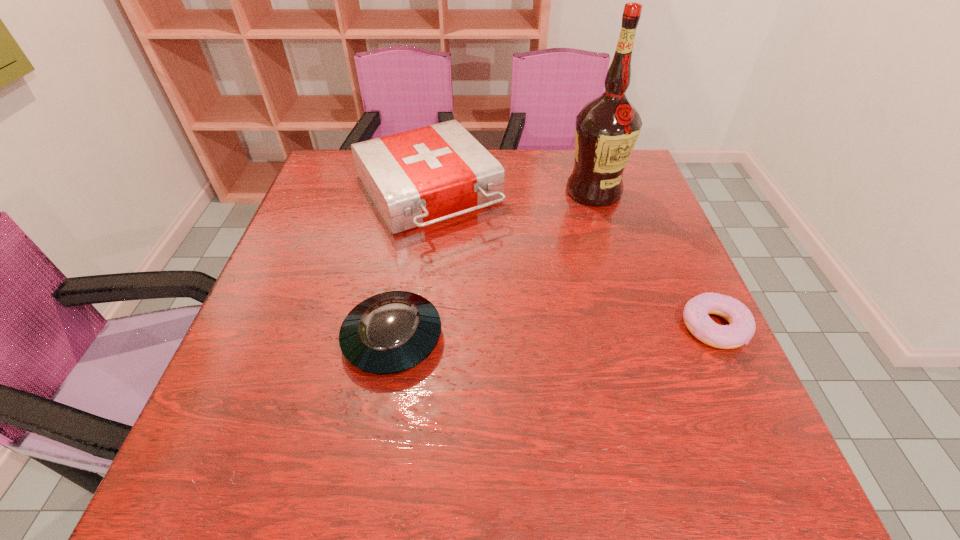
Where is `free space located 0.280m on the label of the tallest object`? The width and height of the screenshot is (960, 540). free space located 0.280m on the label of the tallest object is located at coordinates (583, 284).

Find the location of a particular element. The width and height of the screenshot is (960, 540). free space located 0.230m on the front side of the first-aid kit is located at coordinates (508, 309).

I want to click on free space located on the front side of the first-aid kit, so click(536, 348).

The image size is (960, 540). In order to click on vacant area located 0.140m on the front side of the first-aid kit in this screenshot , I will do `click(488, 281)`.

This screenshot has width=960, height=540. In order to click on alcohol present at the far edge in this screenshot , I will do `click(606, 130)`.

This screenshot has height=540, width=960. Find the location of `the first-aid kit present at the far edge`. the first-aid kit present at the far edge is located at coordinates (416, 178).

The width and height of the screenshot is (960, 540). Identify the location of object at the near edge. (388, 333).

What are the coordinates of `object located at the left edge` in the screenshot? It's located at (416, 178).

Find the location of a particular element. This screenshot has width=960, height=540. doughnut that is at the right edge is located at coordinates (741, 328).

This screenshot has height=540, width=960. Identify the location of alcohol that is at the right edge. (606, 130).